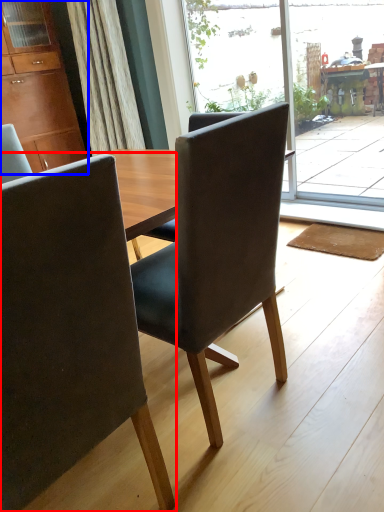
Question: Which of the following is the closest to the observer, chair (highlighted by a red box) or cabinetry (highlighted by a blue box)?

Choices:
 (A) chair
 (B) cabinetry

Answer: (A)